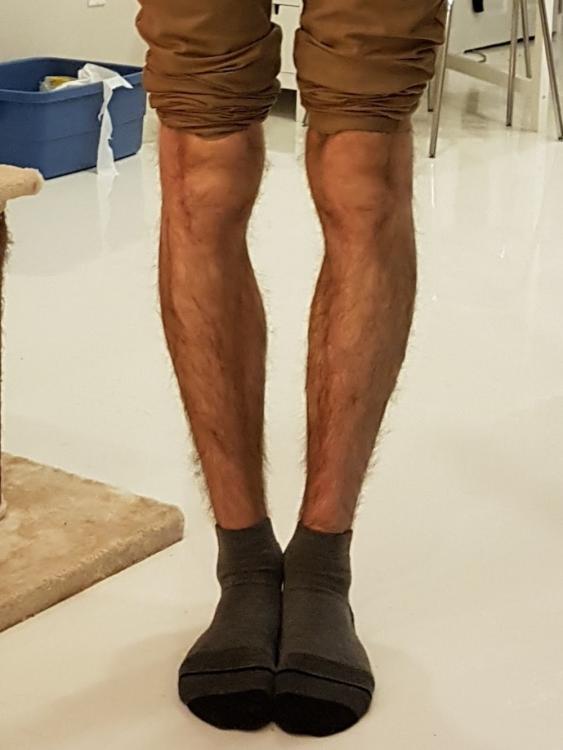
The width and height of the screenshot is (563, 750). I want to click on blue storage bucket with no lid, so click(x=62, y=115).